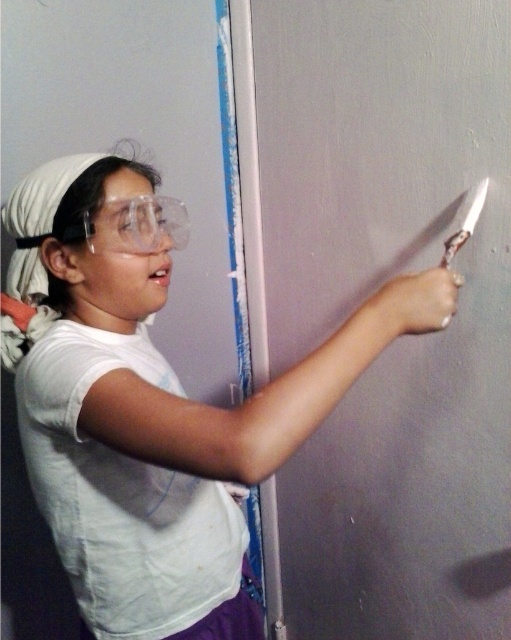
Who is taller, white matte t-shirt at center or metallic silver knife at upper right?

Standing taller between the two is white matte t-shirt at center.

Who is lower down, white matte t-shirt at center or metallic silver knife at upper right?

white matte t-shirt at center is below.

Where is `white matte t-shirt at center`? white matte t-shirt at center is located at coordinates (155, 403).